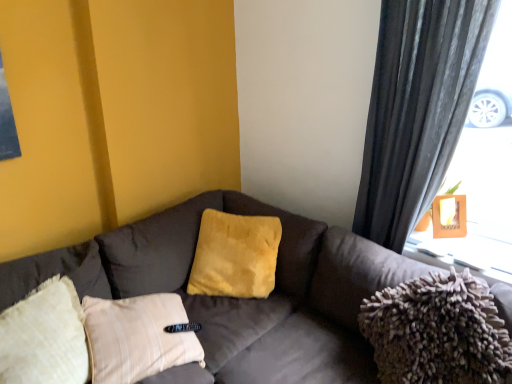
Image resolution: width=512 pixels, height=384 pixels. What do you see at coordinates (417, 108) in the screenshot?
I see `dark gray textured curtain at right` at bounding box center [417, 108].

The width and height of the screenshot is (512, 384). I want to click on dark gray textured curtain at right, so click(417, 108).

Describe the element at coordinates (234, 255) in the screenshot. This screenshot has height=384, width=512. I see `yellow plush pillow at center` at that location.

Find the location of a particular element. wooden frame at upper right is located at coordinates (464, 254).

I want to click on dark gray textured curtain at right, so click(417, 108).

What are the coordinates of `picture frame behind the yellow plush pillow at center` in the screenshot? It's located at pos(449,216).

How different are the orientations of wooden frame at upper right and yellow plush pillow at center in degrees?

They differ by 10.6 degrees in their facing directions.

Is wooden frame at upper right far away from yellow plush pillow at center?

No, wooden frame at upper right is in close proximity to yellow plush pillow at center.

Is point (440, 243) more distant than point (404, 307)?

Yes, point (440, 243) is farther from viewer.

Based on the photo, from a real-world perspective, is wooden frame at upper right below fuzzy fabric pillow at right?

No, from a real-world perspective, wooden frame at upper right is not under fuzzy fabric pillow at right.

Is the depth of wooden frame at upper right greater than that of fuzzy fabric pillow at right?

Yes, it is behind fuzzy fabric pillow at right.

Based on the photo, who is taller, fuzzy fabric pillow at right or wooden frame at upper right?

fuzzy fabric pillow at right.

Is fuzzy fabric pillow at right oriented towards wooden frame at upper right?

No, fuzzy fabric pillow at right is not aimed at wooden frame at upper right.

Consider the image. In the image, is fuzzy fabric pillow at right positioned in front of or behind wooden frame at upper right?

Clearly, fuzzy fabric pillow at right is in front of wooden frame at upper right.

Considering the relative sizes of fuzzy fabric pillow at right and wooden frame at upper right in the image provided, is fuzzy fabric pillow at right thinner than wooden frame at upper right?

No, fuzzy fabric pillow at right is not thinner than wooden frame at upper right.

Which object is further away from the camera, dark gray textured curtain at right or wooden frame at upper right?

wooden frame at upper right is further away from the camera.

Considering the sizes of objects dark gray textured curtain at right and wooden frame at upper right in the image provided, who is wider, dark gray textured curtain at right or wooden frame at upper right?

Wider between the two is dark gray textured curtain at right.

From the image's perspective, does dark gray textured curtain at right appear lower than wooden frame at upper right?

No.

I want to click on curtain above the wooden frame at upper right (from a real-world perspective), so click(x=417, y=108).

Is wooden frame at upper right thinner than wooden frame at upper right?

Yes, wooden frame at upper right is thinner than wooden frame at upper right.

Can you tell me how much wooden frame at upper right and wooden frame at upper right differ in facing direction?

There is a 43.7-degree angle between the facing directions of wooden frame at upper right and wooden frame at upper right.

Which is correct: wooden frame at upper right is inside wooden frame at upper right, or outside of it?

wooden frame at upper right exists outside the volume of wooden frame at upper right.

Is wooden frame at upper right oriented away from wooden frame at upper right?

No, wooden frame at upper right is not facing the opposite direction of wooden frame at upper right.

Consider the image. Which object is closer to the camera, wooden frame at upper right or velvet brown couch at center?

velvet brown couch at center is closer to the camera.

Between wooden frame at upper right and velvet brown couch at center, which one has larger size?

Bigger between the two is velvet brown couch at center.

Locate an element on the screen. The width and height of the screenshot is (512, 384). studio couch on the left of wooden frame at upper right is located at coordinates (237, 298).

Between wooden frame at upper right and wooden frame at upper right, which one appears on the left side from the viewer's perspective?

wooden frame at upper right is more to the left.

From the image's perspective, would you say wooden frame at upper right is shown under wooden frame at upper right?

Indeed, from the image's perspective, wooden frame at upper right is shown beneath wooden frame at upper right.

Looking at the image, does wooden frame at upper right seem bigger or smaller compared to wooden frame at upper right?

Considering their sizes, wooden frame at upper right takes up more space than wooden frame at upper right.

The height and width of the screenshot is (384, 512). What are the coordinates of `picture frame above the yellow plush pillow at center (from a real-world perspective)` in the screenshot? It's located at (449, 216).

In the image, there is a fuzzy fabric pillow at right. Where is `window sill above it (from the image's perspective)`? The image size is (512, 384). window sill above it (from the image's perspective) is located at coordinates (464, 254).

Looking at the image, which one is located closer to dark gray textured curtain at right, yellow plush pillow at center or velvet brown couch at center?

velvet brown couch at center.

Estimate the real-world distances between objects in this image. Which object is closer to dark gray textured curtain at right, wooden frame at upper right or wooden frame at upper right?

wooden frame at upper right.

Based on their spatial positions, is yellow plush pillow at center or fuzzy fabric pillow at right further from velvet brown couch at center?

fuzzy fabric pillow at right.

Looking at the image, which one is located further to wooden frame at upper right, yellow plush pillow at center or velvet brown couch at center?

Among the two, yellow plush pillow at center is located further to wooden frame at upper right.

Based on their spatial positions, is velvet brown couch at center or wooden frame at upper right closer to dark gray textured curtain at right?

Among the two, wooden frame at upper right is located nearer to dark gray textured curtain at right.

When comparing their distances from dark gray textured curtain at right, does velvet brown couch at center or wooden frame at upper right seem further?

velvet brown couch at center.

From the image, which object appears to be farther from fuzzy fabric pillow at right, yellow plush pillow at center or velvet brown couch at center?

Among the two, yellow plush pillow at center is located further to fuzzy fabric pillow at right.

Looking at the image, which one is located further to velvet brown couch at center, dark gray textured curtain at right or yellow plush pillow at center?

dark gray textured curtain at right is further to velvet brown couch at center.

Where is `window sill located between velvet brown couch at center and wooden frame at upper right in the depth direction`? This screenshot has height=384, width=512. window sill located between velvet brown couch at center and wooden frame at upper right in the depth direction is located at coordinates (464, 254).

The image size is (512, 384). In order to click on material located between velvet brown couch at center and wooden frame at upper right in the depth direction in this screenshot , I will do `click(437, 332)`.

Where is `curtain between yellow plush pillow at center and wooden frame at upper right from left to right`? This screenshot has height=384, width=512. curtain between yellow plush pillow at center and wooden frame at upper right from left to right is located at coordinates (417, 108).

Where is `curtain located between velvet brown couch at center and wooden frame at upper right in the depth direction`? The width and height of the screenshot is (512, 384). curtain located between velvet brown couch at center and wooden frame at upper right in the depth direction is located at coordinates (417, 108).